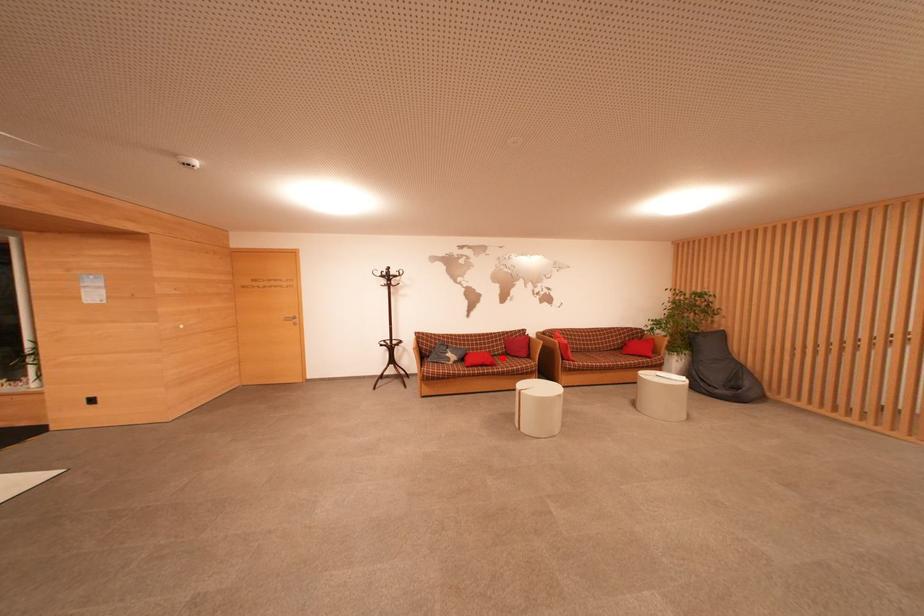
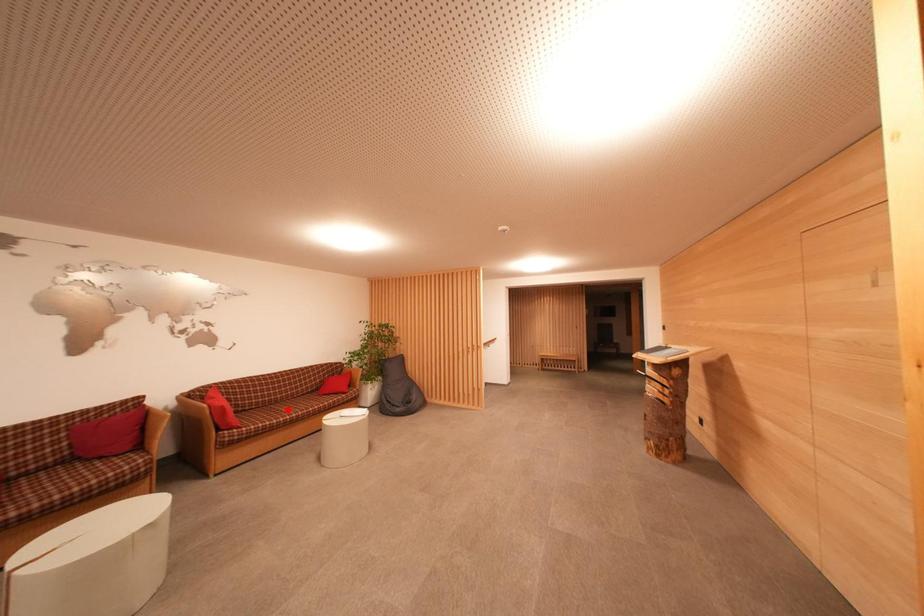
I am providing you with two images of the same scene from different viewpoints. A red point is marked on the first image and another point is marked on the second image. Is the red point in image1 aligned with the point shown in image2?

No